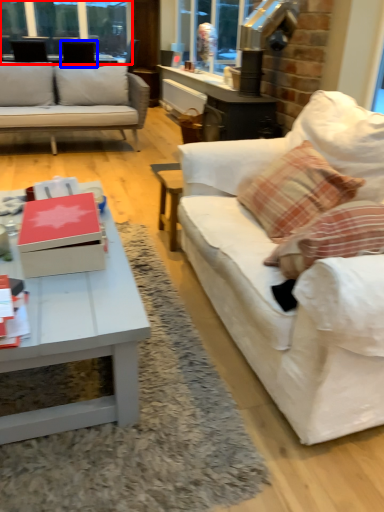
Question: Which object appears closest to the camera in this image, window frame (highlighted by a red box) or armchair (highlighted by a blue box)?

Choices:
 (A) window frame
 (B) armchair

Answer: (B)